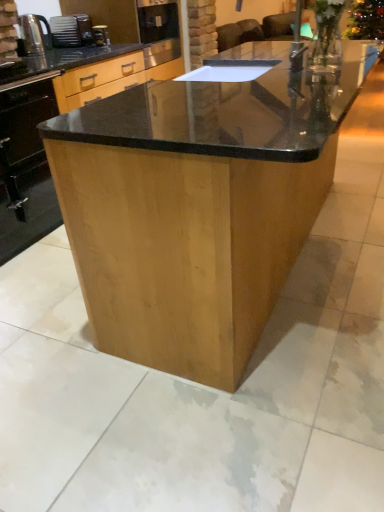
Question: From the image's perspective, is shiny brown wood table at center under metallic silver coffee machine at upper left?

Choices:
 (A) yes
 (B) no

Answer: (A)

Question: Is shiny brown wood table at center smaller than metallic silver coffee machine at upper left?

Choices:
 (A) yes
 (B) no

Answer: (B)

Question: Is metallic silver coffee machine at upper left a part of shiny brown wood table at center?

Choices:
 (A) no
 (B) yes

Answer: (A)

Question: Does shiny brown wood table at center have a larger size compared to metallic silver coffee machine at upper left?

Choices:
 (A) yes
 (B) no

Answer: (A)

Question: Is metallic silver coffee machine at upper left at the back of shiny brown wood table at center?

Choices:
 (A) yes
 (B) no

Answer: (A)

Question: Does shiny brown wood table at center have a greater width compared to metallic silver coffee machine at upper left?

Choices:
 (A) yes
 (B) no

Answer: (A)

Question: Is metallic silver kettle at left bigger than metallic silver coffee machine at upper left?

Choices:
 (A) no
 (B) yes

Answer: (B)

Question: Could you tell me if metallic silver kettle at left is turned towards metallic silver coffee machine at upper left?

Choices:
 (A) no
 (B) yes

Answer: (A)

Question: Can you confirm if metallic silver kettle at left is shorter than metallic silver coffee machine at upper left?

Choices:
 (A) yes
 (B) no

Answer: (B)

Question: Considering the relative sizes of metallic silver kettle at left and metallic silver coffee machine at upper left in the image provided, is metallic silver kettle at left thinner than metallic silver coffee machine at upper left?

Choices:
 (A) no
 (B) yes

Answer: (A)

Question: Is the depth of metallic silver kettle at left greater than that of metallic silver coffee machine at upper left?

Choices:
 (A) no
 (B) yes

Answer: (A)

Question: Would you consider metallic silver kettle at left to be distant from metallic silver coffee machine at upper left?

Choices:
 (A) yes
 (B) no

Answer: (B)

Question: Is metallic silver kettle at left positioned before black glossy oven at lower left?

Choices:
 (A) yes
 (B) no

Answer: (B)